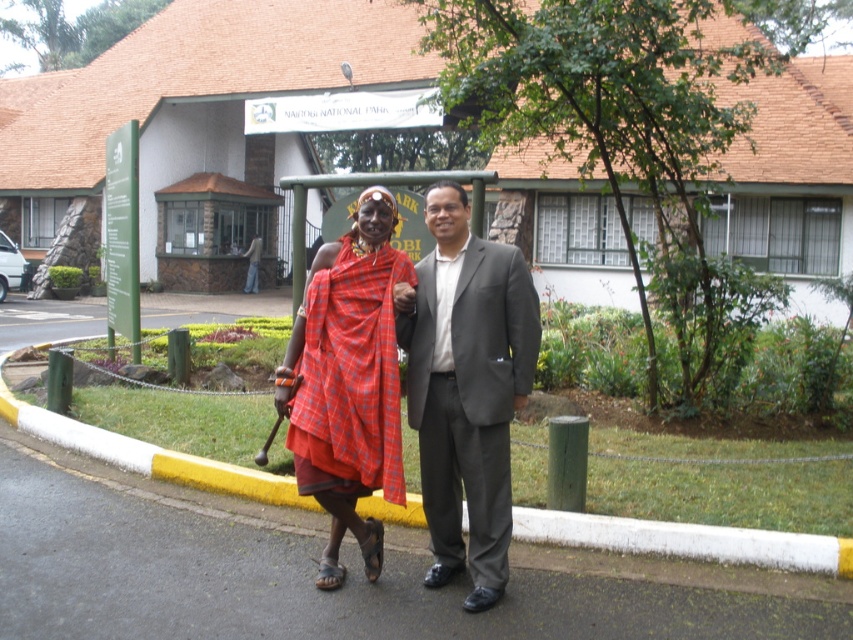
Is matte gray suit at center shorter than yellow rubber curb at lower center?

No.

From the picture: Can you confirm if matte gray suit at center is positioned below yellow rubber curb at lower center?

Incorrect, matte gray suit at center is not positioned below yellow rubber curb at lower center.

Which is behind, point (500, 432) or point (809, 557)?

Positioned behind is point (809, 557).

Find the location of a particular element. The height and width of the screenshot is (640, 853). matte gray suit at center is located at coordinates (466, 387).

Measure the distance between matte gray suit at center and red plaid cloth at center.

They are 36.02 centimeters apart.

Is the position of matte gray suit at center less distant than that of red plaid cloth at center?

That is True.

Is point (463, 557) positioned in front of point (294, 472)?

Yes, point (463, 557) is in front of point (294, 472).

Where is `matte gray suit at center`? The height and width of the screenshot is (640, 853). matte gray suit at center is located at coordinates (466, 387).

Image resolution: width=853 pixels, height=640 pixels. What do you see at coordinates (347, 381) in the screenshot? I see `red plaid cloth at center` at bounding box center [347, 381].

Between point (331, 572) and point (368, 506), which one is positioned in front?

Point (331, 572) is in front.

Find the location of `red plaid cloth at center`. red plaid cloth at center is located at coordinates (347, 381).